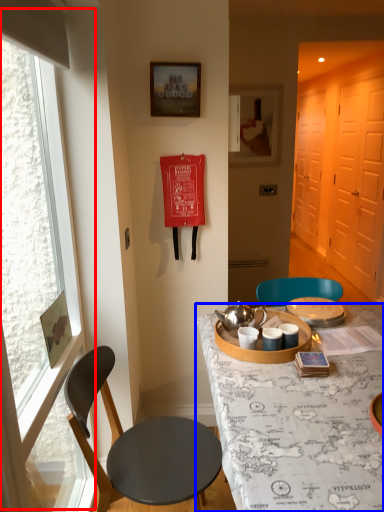
Question: Among these objects, which one is farthest to the camera, window (highlighted by a red box) or desk (highlighted by a blue box)?

Choices:
 (A) window
 (B) desk

Answer: (B)